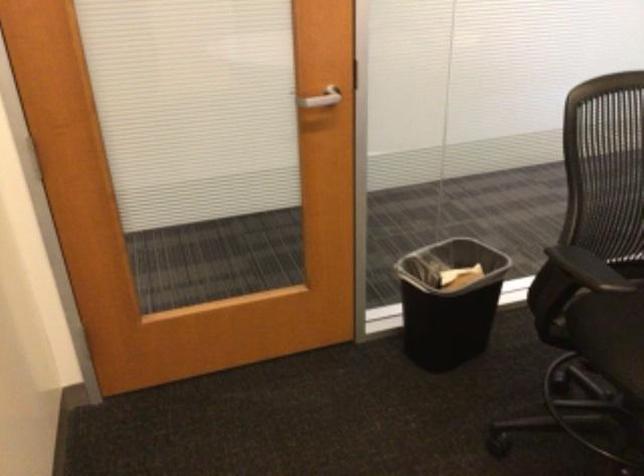
The width and height of the screenshot is (644, 476). What do you see at coordinates (590, 270) in the screenshot?
I see `the chair armrest` at bounding box center [590, 270].